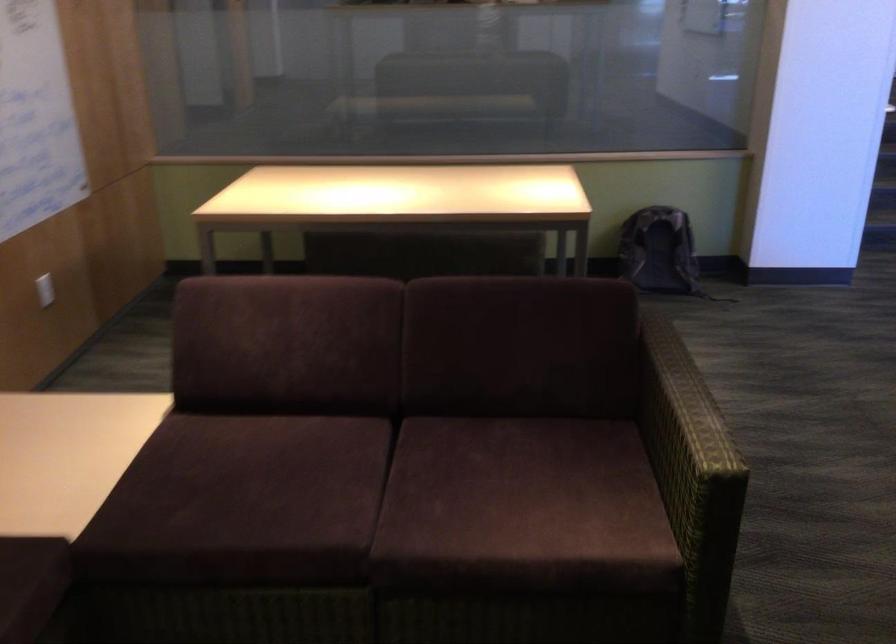
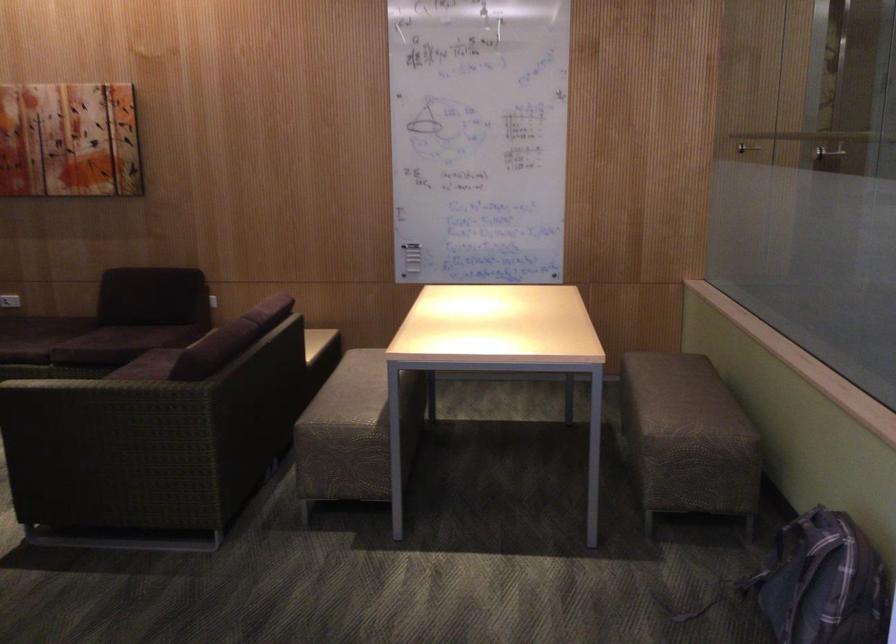
Question: I am providing you with two images of the same scene from different viewpoints. Which of the following objects are not visible in image2?

Choices:
 (A) metal partition handle
 (B) black bowl
 (C) sofa sitting surface
 (D) patterned sofa armrest

Answer: (C)